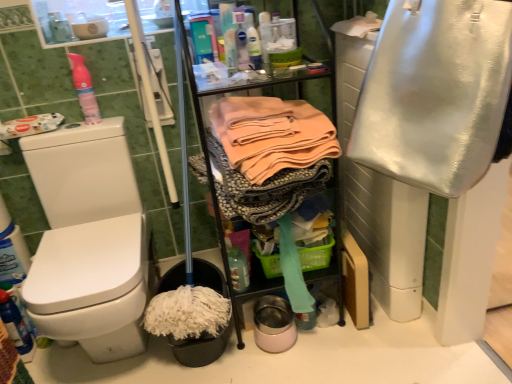
Question: Could pink matte spray can at upper left be considered to be inside translucent plastic bottle at center?

Choices:
 (A) yes
 (B) no

Answer: (B)

Question: From the image's perspective, is translucent plastic bottle at center under pink matte spray can at upper left?

Choices:
 (A) no
 (B) yes

Answer: (B)

Question: Considering the relative sizes of translucent plastic bottle at center and pink matte spray can at upper left in the image provided, is translucent plastic bottle at center thinner than pink matte spray can at upper left?

Choices:
 (A) yes
 (B) no

Answer: (B)

Question: Can you confirm if translucent plastic bottle at center is bigger than pink matte spray can at upper left?

Choices:
 (A) no
 (B) yes

Answer: (A)

Question: Considering the relative positions of translucent plastic bottle at center and pink matte spray can at upper left in the image provided, is translucent plastic bottle at center to the right of pink matte spray can at upper left from the viewer's perspective?

Choices:
 (A) no
 (B) yes

Answer: (B)

Question: Are translucent plastic bottle at center and pink matte spray can at upper left located far from each other?

Choices:
 (A) no
 (B) yes

Answer: (A)

Question: From a real-world perspective, is soft peach fabric at center, which ranks as the second clothing in right-to-left order, located higher than pink matte spray can at upper left?

Choices:
 (A) yes
 (B) no

Answer: (B)

Question: From the image's perspective, is soft peach fabric at center, the first clothing viewed from the left, located beneath pink matte spray can at upper left?

Choices:
 (A) yes
 (B) no

Answer: (A)

Question: Can you confirm if soft peach fabric at center, which ranks as the second clothing in right-to-left order, is thinner than pink matte spray can at upper left?

Choices:
 (A) yes
 (B) no

Answer: (B)

Question: From the image's perspective, is soft peach fabric at center, the first clothing viewed from the left, over pink matte spray can at upper left?

Choices:
 (A) yes
 (B) no

Answer: (B)

Question: Can you confirm if soft peach fabric at center, the first clothing viewed from the left, is positioned to the left of pink matte spray can at upper left?

Choices:
 (A) no
 (B) yes

Answer: (A)

Question: Considering the relative sizes of soft peach fabric at center, which ranks as the second clothing in right-to-left order, and pink matte spray can at upper left in the image provided, is soft peach fabric at center, which ranks as the second clothing in right-to-left order, taller than pink matte spray can at upper left?

Choices:
 (A) no
 (B) yes

Answer: (B)

Question: Considering the relative sizes of translucent plastic bottle at center and green plastic basket at center in the image provided, is translucent plastic bottle at center bigger than green plastic basket at center?

Choices:
 (A) no
 (B) yes

Answer: (A)